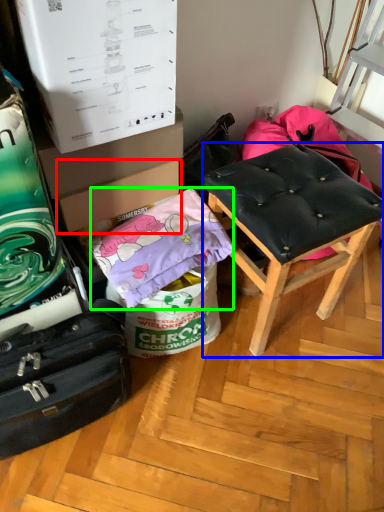
Question: Considering the real-world distances, which object is closest to cardboard box (highlighted by a red box)? stool (highlighted by a blue box) or material (highlighted by a green box).

Choices:
 (A) stool
 (B) material

Answer: (B)